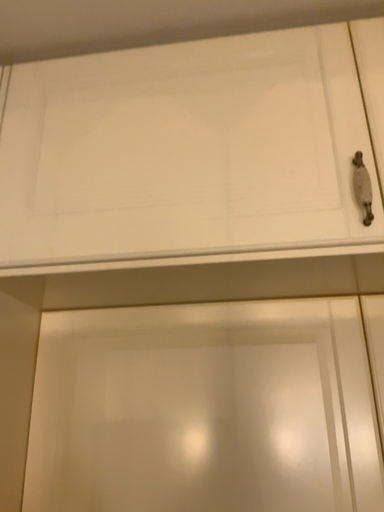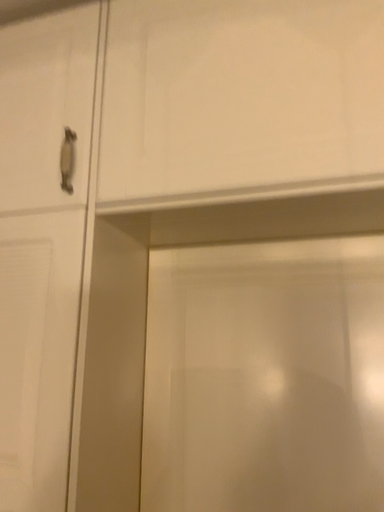
Question: Which way did the camera rotate in the video?

Choices:
 (A) rotated downward
 (B) rotated upward

Answer: (A)